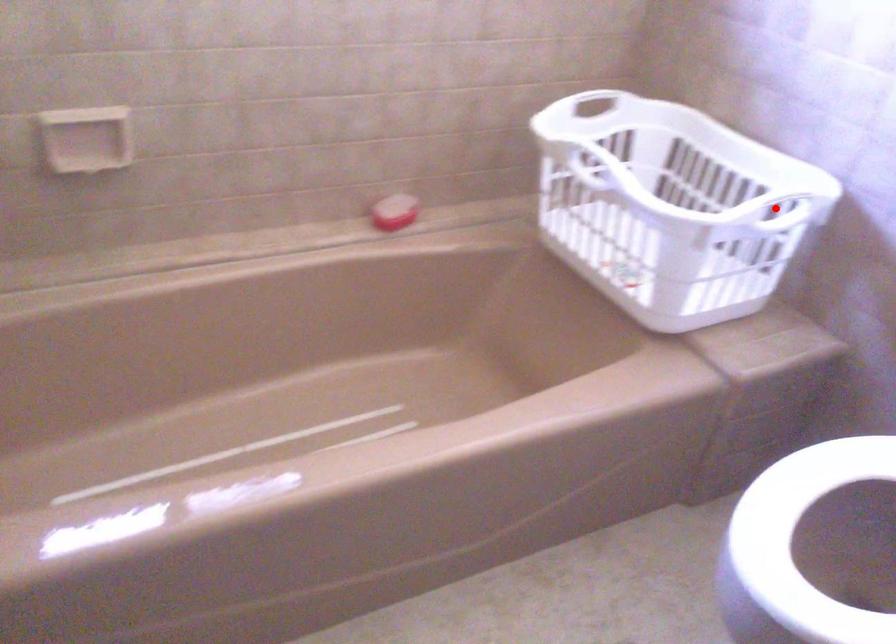
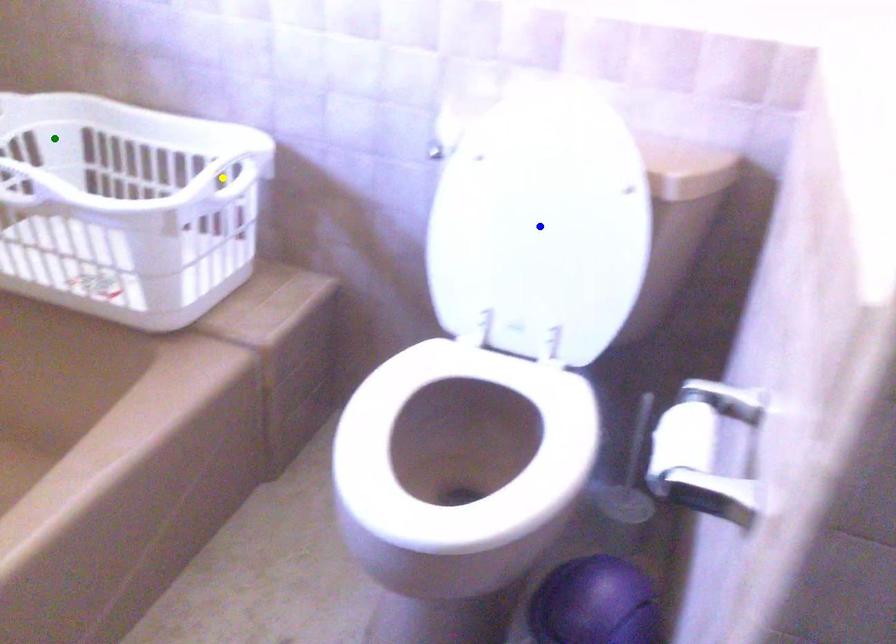
Question: I am providing you with two images of the same scene from different viewpoints. A red point is marked on the first image. You are given multiple points on the second image. Which point in image 2 is actually the same real-world point as the red point in image 1?

Choices:
 (A) yellow point
 (B) green point
 (C) blue point

Answer: (A)